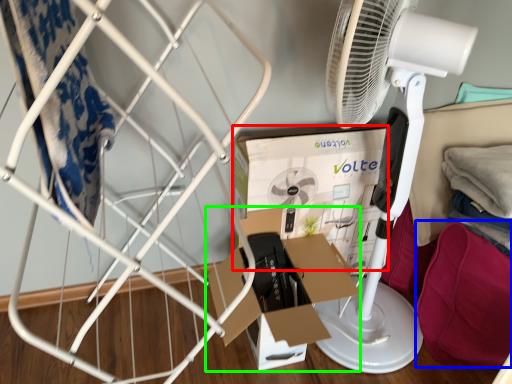
Question: Which is nearer to the box (highlighted by a red box)? clothing (highlighted by a blue box) or cardboard box (highlighted by a green box).

Choices:
 (A) clothing
 (B) cardboard box

Answer: (B)